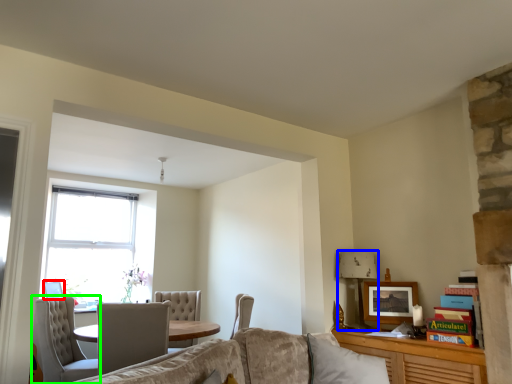
Question: Which object is the closest to the picture frame (highlighted by a red box)? Choose among these: lamp (highlighted by a blue box) or chair (highlighted by a green box).

Choices:
 (A) lamp
 (B) chair

Answer: (B)